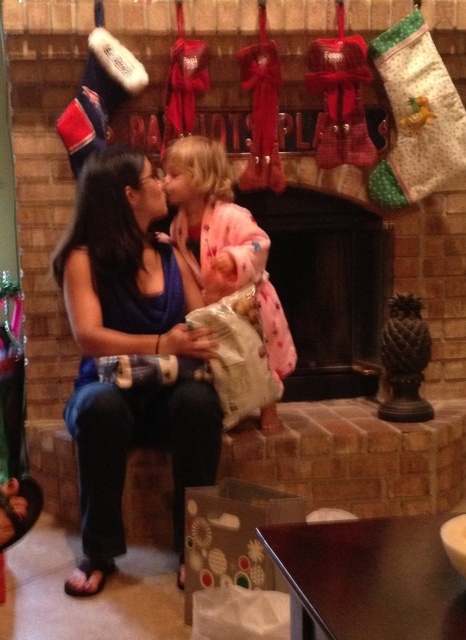
What is located at the coordinate point (129,353) in the image?

The blue fabric shirt at center is located at the coordinate point (129,353).

You are an interior designer planning to place a new painting above the black matte fireplace at center. The painting has dimensions of 1.2 meters in width and 0.8 meters in height. Given the fireplace is at coordinates 0.448, 0.702 in the room, can you determine if the painting will fit above it?

The black matte fireplace at center is located at coordinates (327, 285). To determine if the painting will fit, we need to know the available space above the fireplace. However, the provided information does not include details about the dimensions or clearance above the fireplace. Without this data, it is impossible to confirm if the painting will fit.